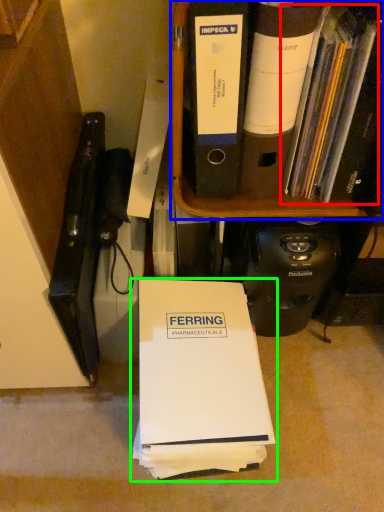
Question: Which object is positioned farthest from book (highlighted by a red box)? Select from bookcase (highlighted by a blue box) and book (highlighted by a green box).

Choices:
 (A) bookcase
 (B) book

Answer: (B)